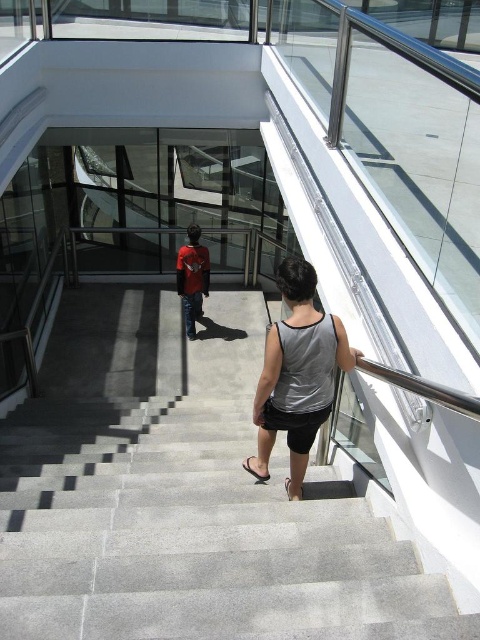
You are standing at the top of the gray concrete stairs at center and want to reach the red shirt at center. Which direction should you go?

The gray concrete stairs at center is below the red shirt at center, so to reach the red shirt at center, you should go downward.

You are a photographer positioned at the camera location, and you want to capture a closeup shot of the gray fabric tank top at center. Given that your camera has a minimum focusing distance of 2 meters, will you be able to take the photo without moving closer?

The gray fabric tank top at center is 2.69 meters from the camera. Since the minimum focusing distance is 2 meters, the photographer can take the closeup shot without moving closer because the object is within the camera range.